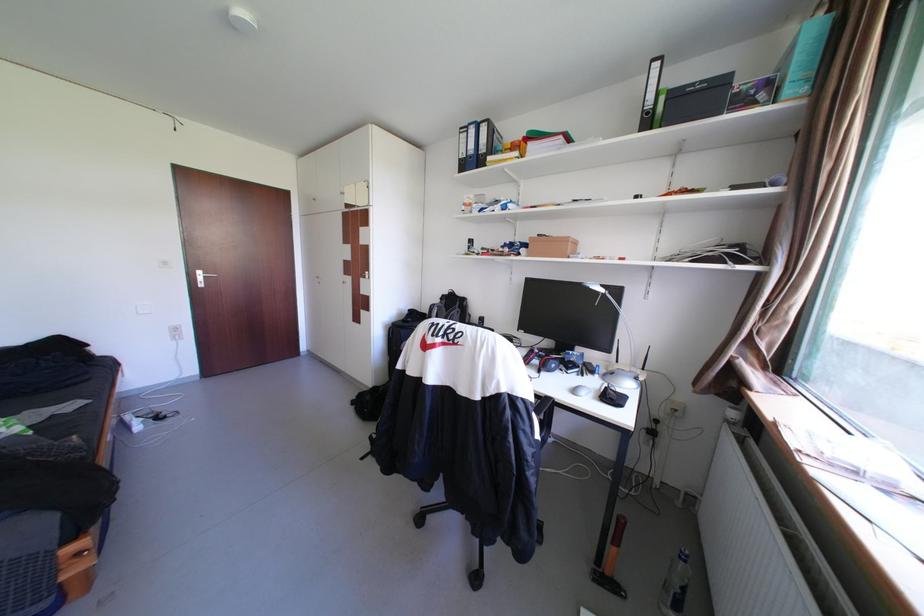
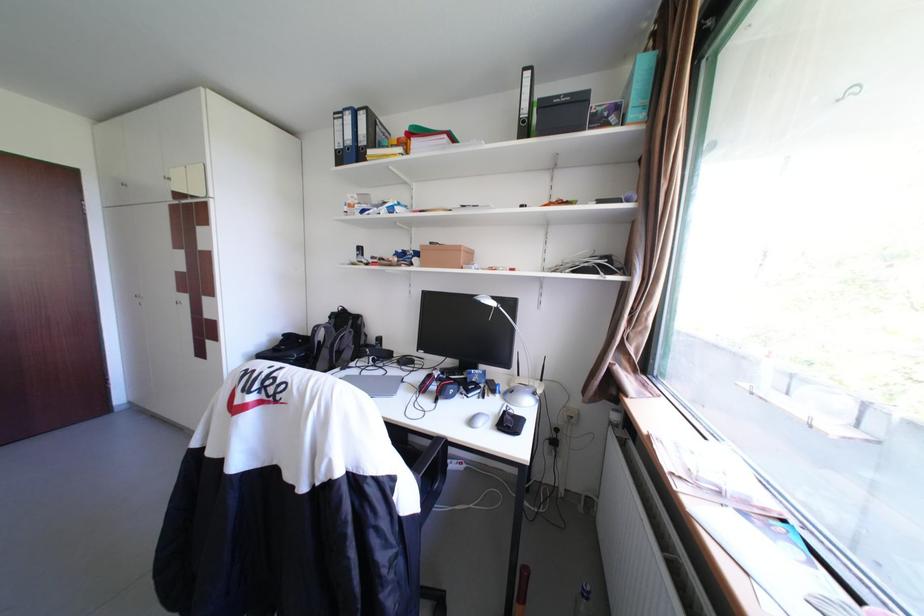
The point at (585, 391) is marked in the first image. Where is the corresponding point in the second image?

(481, 422)